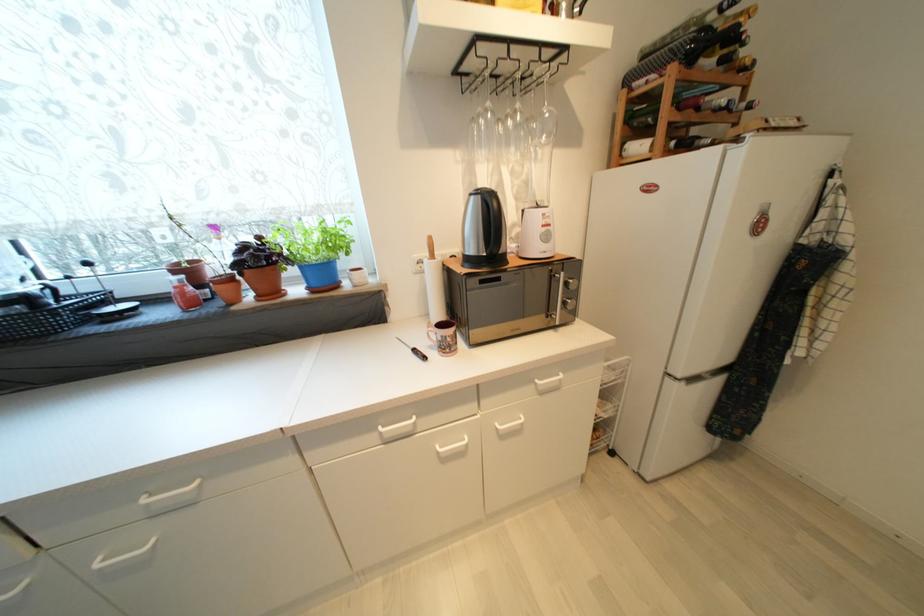
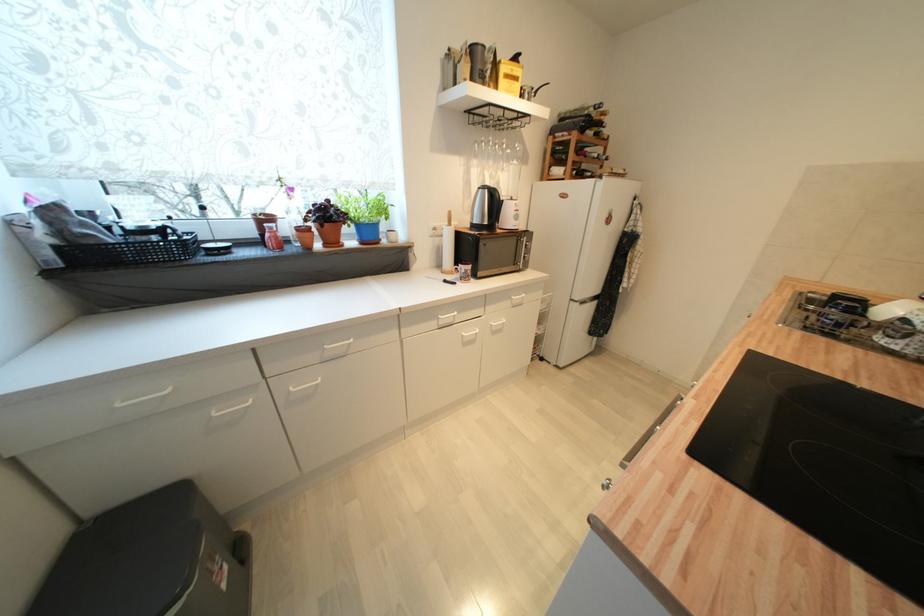
The point at (x=520, y=114) is marked in the first image. Where is the corresponding point in the second image?

(507, 146)